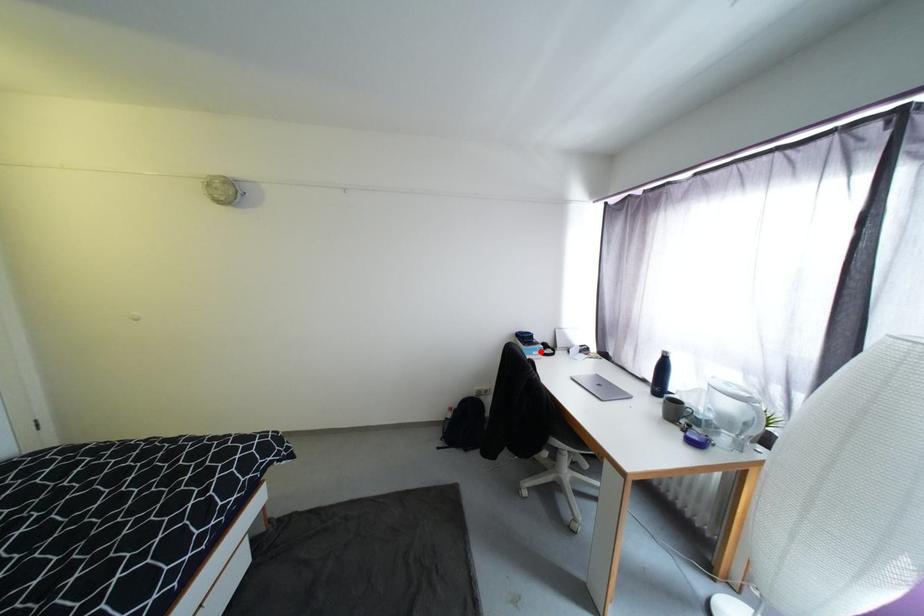
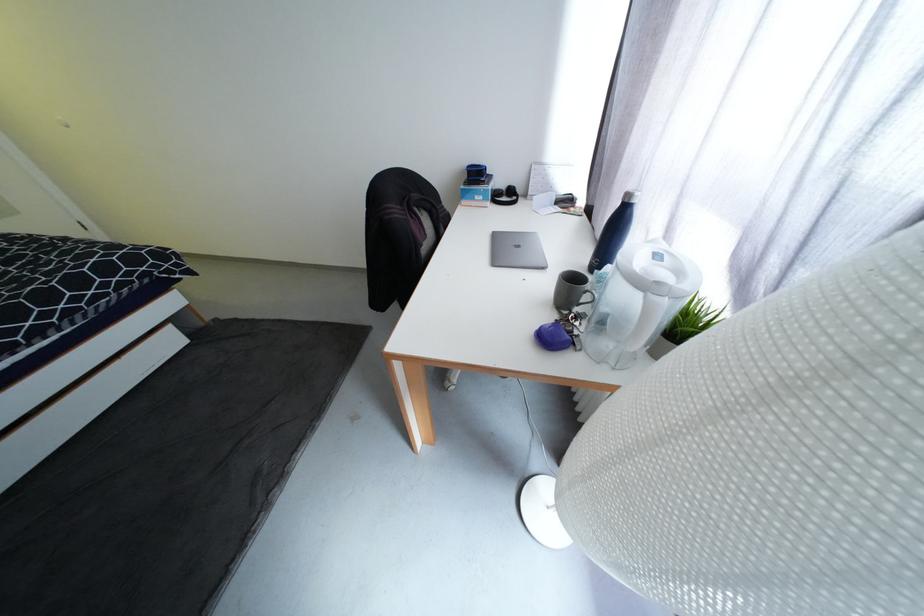
Question: I am providing you with two images of the same scene from different viewpoints. Given a red point in image1, look at the same physical point in image2. Is it:

Choices:
 (A) Closer to the viewpoint
 (B) Farther from the viewpoint

Answer: (A)